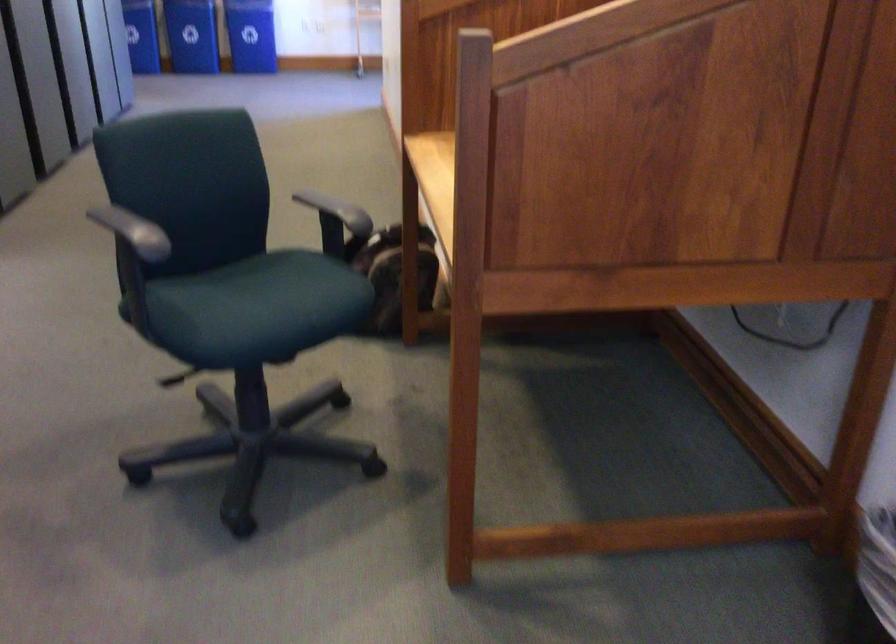
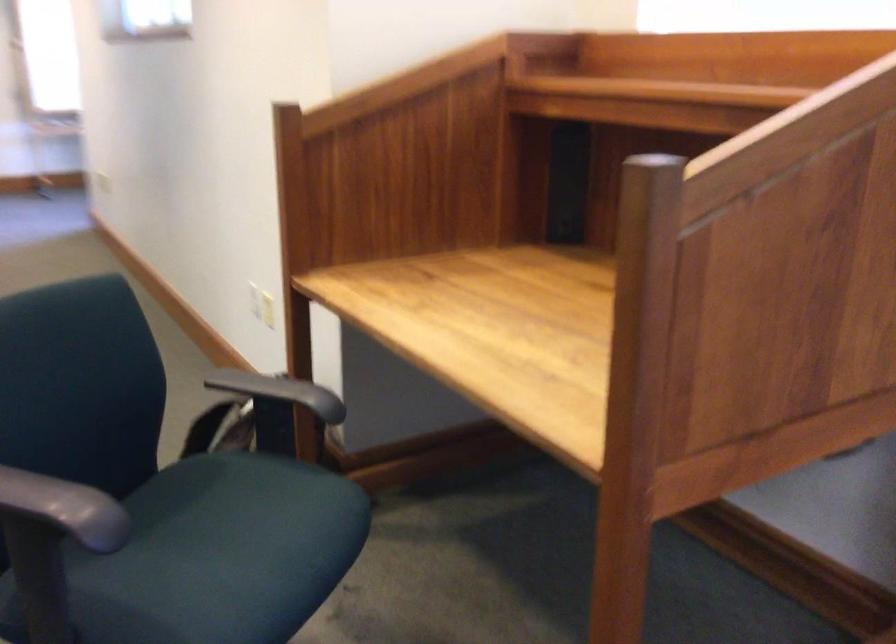
Consider the image. What movement of the cameraman would produce the second image?

The movement direction of the cameraman is left, forward.